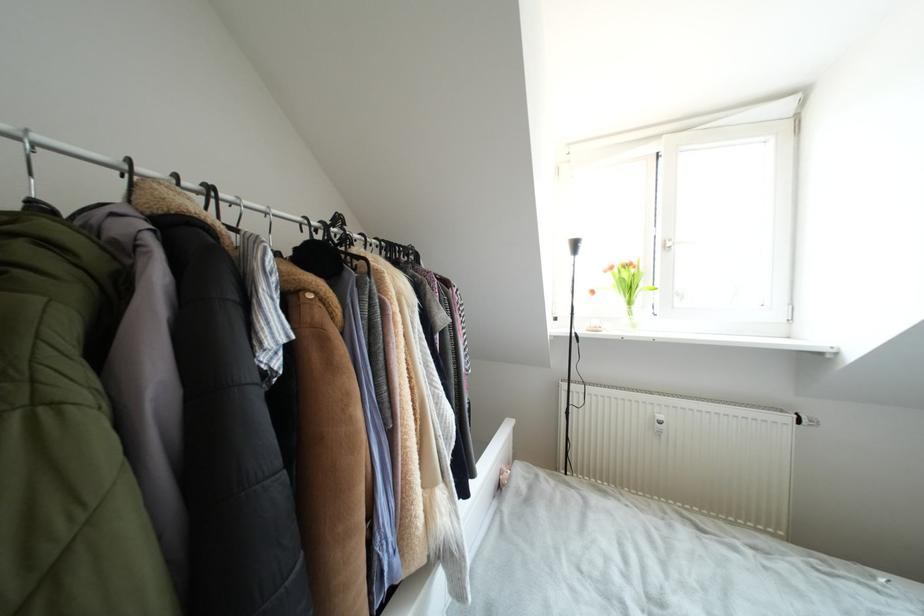
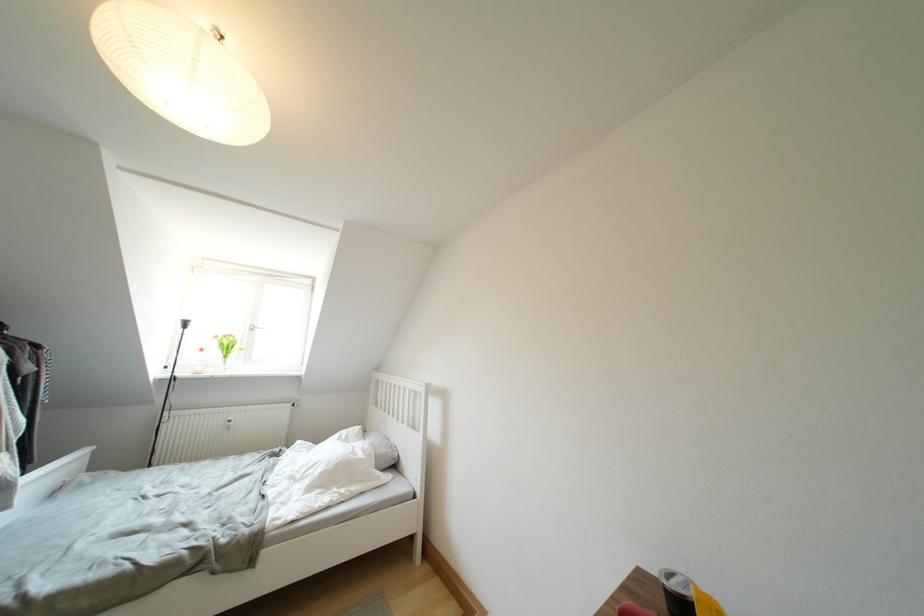
Find the pixel in the second image that matches (x=616, y=272) in the first image.

(222, 341)